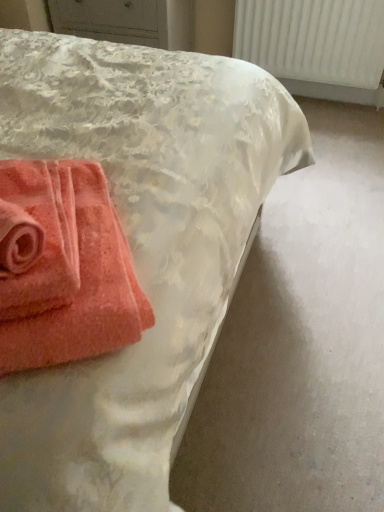
Image resolution: width=384 pixels, height=512 pixels. What do you see at coordinates (37, 238) in the screenshot? I see `coral soft towel at lower left, positioned as the 2th towel in right-to-left order` at bounding box center [37, 238].

The width and height of the screenshot is (384, 512). Describe the element at coordinates (63, 267) in the screenshot. I see `coral terry cloth towel at lower left, marked as the first towel in a right-to-left arrangement` at that location.

What do you see at coordinates (313, 39) in the screenshot? I see `white textured radiator at upper right` at bounding box center [313, 39].

Image resolution: width=384 pixels, height=512 pixels. In order to click on coral soft towel at lower left, positioned as the 2th towel in right-to-left order in this screenshot , I will do 37,238.

How many degrees apart are the facing directions of coral soft towel at lower left, which is the first towel from left to right, and white textured radiator at upper right?

A: The angular difference between coral soft towel at lower left, which is the first towel from left to right, and white textured radiator at upper right is 38 degrees.

Can you confirm if coral soft towel at lower left, positioned as the 2th towel in right-to-left order, is smaller than white textured radiator at upper right?

Yes.

Where is `radiator behind the coral soft towel at lower left, positioned as the 2th towel in right-to-left order`? The image size is (384, 512). radiator behind the coral soft towel at lower left, positioned as the 2th towel in right-to-left order is located at coordinates (313, 39).

From a real-world perspective, between coral soft towel at lower left, positioned as the 2th towel in right-to-left order, and white textured radiator at upper right, who is vertically lower?

white textured radiator at upper right, from a real-world perspective.

Is coral soft towel at lower left, which is the first towel from left to right, at the left side of coral terry cloth towel at lower left, marked as the first towel in a right-to-left arrangement?

Indeed, coral soft towel at lower left, which is the first towel from left to right, is positioned on the left side of coral terry cloth towel at lower left, marked as the first towel in a right-to-left arrangement.

In the scene shown: From a real-world perspective, is coral soft towel at lower left, which is the first towel from left to right, on coral terry cloth towel at lower left, marked as the first towel in a right-to-left arrangement?

Yes, from a real-world perspective, coral soft towel at lower left, which is the first towel from left to right, is on top of coral terry cloth towel at lower left, marked as the first towel in a right-to-left arrangement.

Which of these two, coral soft towel at lower left, which is the first towel from left to right, or coral terry cloth towel at lower left, marked as the first towel in a right-to-left arrangement, is smaller?

coral soft towel at lower left, which is the first towel from left to right, is smaller.

Considering the relative sizes of coral soft towel at lower left, positioned as the 2th towel in right-to-left order, and coral terry cloth towel at lower left, the 2th towel from the left, in the image provided, is coral soft towel at lower left, positioned as the 2th towel in right-to-left order, wider than coral terry cloth towel at lower left, the 2th towel from the left,?

No.

Which is behind, coral terry cloth towel at lower left, marked as the first towel in a right-to-left arrangement, or coral soft towel at lower left, which is the first towel from left to right?

coral soft towel at lower left, which is the first towel from left to right, is more distant.

Who is taller, coral terry cloth towel at lower left, marked as the first towel in a right-to-left arrangement, or coral soft towel at lower left, positioned as the 2th towel in right-to-left order?

Standing taller between the two is coral terry cloth towel at lower left, marked as the first towel in a right-to-left arrangement.

At what (x,y) coordinates should I click in order to perform the action: click on towel located on the left of coral terry cloth towel at lower left, the 2th towel from the left. Please return your answer as a coordinate pair (x, y). The width and height of the screenshot is (384, 512). Looking at the image, I should click on (37, 238).

Based on the photo, between coral terry cloth towel at lower left, marked as the first towel in a right-to-left arrangement, and coral soft towel at lower left, positioned as the 2th towel in right-to-left order, which one appears on the left side from the viewer's perspective?

coral soft towel at lower left, positioned as the 2th towel in right-to-left order.

Does coral terry cloth towel at lower left, marked as the first towel in a right-to-left arrangement, have a lesser height compared to white textured radiator at upper right?

Indeed, coral terry cloth towel at lower left, marked as the first towel in a right-to-left arrangement, has a lesser height compared to white textured radiator at upper right.

In the image, is coral terry cloth towel at lower left, marked as the first towel in a right-to-left arrangement, on the left side or the right side of white textured radiator at upper right?

coral terry cloth towel at lower left, marked as the first towel in a right-to-left arrangement, is to the left of white textured radiator at upper right.

From the image's perspective, which one is positioned lower, coral terry cloth towel at lower left, the 2th towel from the left, or white textured radiator at upper right?

coral terry cloth towel at lower left, the 2th towel from the left, is shown below in the image.

Would you consider coral terry cloth towel at lower left, marked as the first towel in a right-to-left arrangement, to be distant from white textured radiator at upper right?

Yes.

The image size is (384, 512). What are the coordinates of `radiator that is above the coral soft towel at lower left, which is the first towel from left to right (from the image's perspective)` in the screenshot? It's located at (313, 39).

Does white textured radiator at upper right lie behind coral soft towel at lower left, which is the first towel from left to right?

Yes, it is behind coral soft towel at lower left, which is the first towel from left to right.

From a real-world perspective, is white textured radiator at upper right under coral soft towel at lower left, positioned as the 2th towel in right-to-left order?

Indeed, from a real-world perspective, white textured radiator at upper right is positioned beneath coral soft towel at lower left, positioned as the 2th towel in right-to-left order.

Between white textured radiator at upper right and coral soft towel at lower left, which is the first towel from left to right, which one has less height?

Standing shorter between the two is coral soft towel at lower left, which is the first towel from left to right.

From a real-world perspective, between white textured radiator at upper right and coral terry cloth towel at lower left, marked as the first towel in a right-to-left arrangement, who is vertically higher?

In real-world perspective, coral terry cloth towel at lower left, marked as the first towel in a right-to-left arrangement, is above.

From the image's perspective, is white textured radiator at upper right on top of coral terry cloth towel at lower left, marked as the first towel in a right-to-left arrangement?

Correct, white textured radiator at upper right appears higher than coral terry cloth towel at lower left, marked as the first towel in a right-to-left arrangement, in the image.

Which of these two, white textured radiator at upper right or coral terry cloth towel at lower left, the 2th towel from the left, stands taller?

Standing taller between the two is white textured radiator at upper right.

How much distance is there between white textured radiator at upper right and coral terry cloth towel at lower left, the 2th towel from the left?

They are 2.12 meters apart.

Starting from the white textured radiator at upper right, which towel is the 1st one in front? Please provide its 2D coordinates.

[(37, 238)]

Find the location of a particular element. The image size is (384, 512). towel below the coral soft towel at lower left, positioned as the 2th towel in right-to-left order (from a real-world perspective) is located at coordinates (63, 267).

From the image, which object appears to be farther from coral soft towel at lower left, positioned as the 2th towel in right-to-left order, white textured radiator at upper right or coral terry cloth towel at lower left, marked as the first towel in a right-to-left arrangement?

white textured radiator at upper right.

Considering their positions, is coral terry cloth towel at lower left, the 2th towel from the left, positioned further to coral soft towel at lower left, which is the first towel from left to right, than white textured radiator at upper right?

white textured radiator at upper right is positioned further to the anchor coral soft towel at lower left, which is the first towel from left to right.

Which object lies nearer to the anchor point coral terry cloth towel at lower left, marked as the first towel in a right-to-left arrangement, white textured radiator at upper right or coral soft towel at lower left, which is the first towel from left to right?

Among the two, coral soft towel at lower left, which is the first towel from left to right, is located nearer to coral terry cloth towel at lower left, marked as the first towel in a right-to-left arrangement.

Based on their spatial positions, is coral soft towel at lower left, positioned as the 2th towel in right-to-left order, or white textured radiator at upper right closer to coral terry cloth towel at lower left, marked as the first towel in a right-to-left arrangement?

coral soft towel at lower left, positioned as the 2th towel in right-to-left order.

Which object lies further to the anchor point white textured radiator at upper right, coral terry cloth towel at lower left, marked as the first towel in a right-to-left arrangement, or coral soft towel at lower left, which is the first towel from left to right?

coral soft towel at lower left, which is the first towel from left to right, is positioned further to the anchor white textured radiator at upper right.

Estimate the real-world distances between objects in this image. Which object is further from white textured radiator at upper right, coral soft towel at lower left, which is the first towel from left to right, or coral terry cloth towel at lower left, the 2th towel from the left?

The object further to white textured radiator at upper right is coral soft towel at lower left, which is the first towel from left to right.

Find the location of a particular element. towel between coral terry cloth towel at lower left, marked as the first towel in a right-to-left arrangement, and white textured radiator at upper right, along the z-axis is located at coordinates (37, 238).